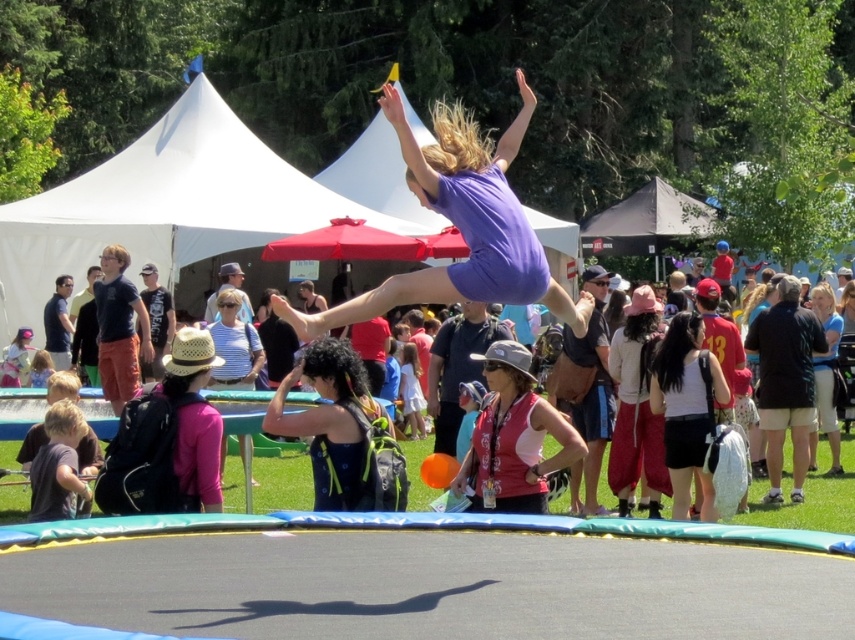
You are a photographer at the event and want to capture both the pink fabric hat at center and the light blue shirt at upper right in a single shot. Which object should you focus on first to ensure both are in frame?

The pink fabric hat at center is taller than the light blue shirt at upper right, so focusing on the pink fabric hat at center first will help ensure both are within the frame.

You are organizing a backpacking trip and need to pack your gear. You have a dark blue fabric backpack at center and white matte shorts at center. Which item can hold more items?

The white matte shorts at center can hold more items since the dark blue fabric backpack at center has a smaller size compared to it.

Based on the photo, you are standing at the edge of the trampoline and want to place a small flag exactly at the center of the trampoline. According to the image, where should you place the flag? Please provide coordinates in the format of point coordinates like point (340, 429).

The point corresponding to the center of the trampoline is point (340, 429), which is where the dark blue fabric backpack at center is located. Therefore, you should place the flag at point (340, 429).